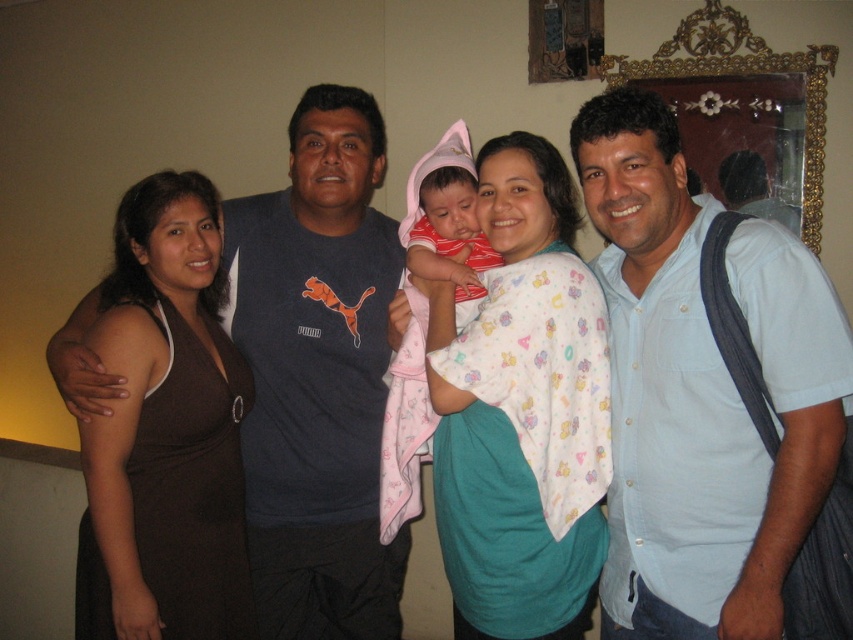
Measure the distance between point (511, 426) and camera.

Point (511, 426) is 1.62 meters from camera.

Is point (544, 404) positioned in front of point (184, 600)?

Yes, point (544, 404) is in front of point (184, 600).

Is point (491, 225) positioned behind point (186, 554)?

No, (491, 225) is in front of (186, 554).

You are a GUI agent. You are given a task and a screenshot of the screen. Output one action in this format:
    pyautogui.click(x=<x>, y=<y>)
    Task: Click on the white cotton shirt at center
    The height and width of the screenshot is (640, 853).
    Given the screenshot: What is the action you would take?
    pyautogui.click(x=521, y=412)

Can you confirm if brown dress at left is positioned above matte pink fabric baby at center?

No, brown dress at left is not above matte pink fabric baby at center.

Does brown dress at left have a lesser width compared to matte pink fabric baby at center?

Incorrect, brown dress at left's width is not less than matte pink fabric baby at center's.

You are a GUI agent. You are given a task and a screenshot of the screen. Output one action in this format:
    pyautogui.click(x=<x>, y=<y>)
    Task: Click on the brown dress at left
    
    Given the screenshot: What is the action you would take?
    pyautogui.click(x=165, y=433)

Is point (569, 371) more distant than point (485, 241)?

No, it is not.

Can you confirm if white cotton shirt at center is positioned to the right of matte pink fabric baby at center?

Correct, you'll find white cotton shirt at center to the right of matte pink fabric baby at center.

Which is behind, point (502, 163) or point (498, 253)?

Positioned behind is point (498, 253).

Where is `white cotton shirt at center`? The height and width of the screenshot is (640, 853). white cotton shirt at center is located at coordinates (521, 412).